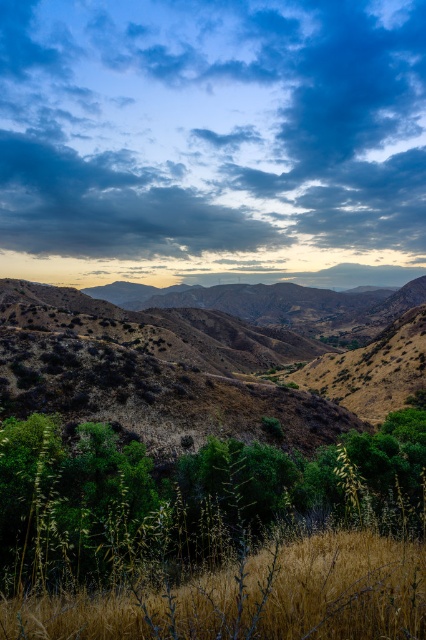
Who is shorter, green leafy tree at lower left or dry grass at lower center?

dry grass at lower center

Is green leafy tree at lower left above dry grass at lower center?

No, green leafy tree at lower left is not above dry grass at lower center.

Which is in front, point (275, 525) or point (348, 540)?

Point (348, 540) is in front.

This screenshot has height=640, width=426. In order to click on green leafy tree at lower left in this screenshot , I will do `click(187, 499)`.

Is cloudy sky at upper center smaller than dry grass at lower center?

Actually, cloudy sky at upper center might be larger than dry grass at lower center.

Is point (414, 268) more distant than point (0, 628)?

Yes, point (414, 268) is behind point (0, 628).

Is point (51, 211) more distant than point (161, 624)?

Yes, it is behind point (161, 624).

What are the coordinates of `cloudy sky at upper center` in the screenshot? It's located at (213, 140).

At what (x,y) coordinates should I click in order to perform the action: click on cloudy sky at upper center. Please return your answer as a coordinate pair (x, y). Image resolution: width=426 pixels, height=640 pixels. Looking at the image, I should click on (213, 140).

Is cloudy sky at upper center to the right of green leafy tree at lower left from the viewer's perspective?

Yes, cloudy sky at upper center is to the right of green leafy tree at lower left.

This screenshot has width=426, height=640. What do you see at coordinates (213, 140) in the screenshot?
I see `cloudy sky at upper center` at bounding box center [213, 140].

This screenshot has width=426, height=640. I want to click on cloudy sky at upper center, so click(213, 140).